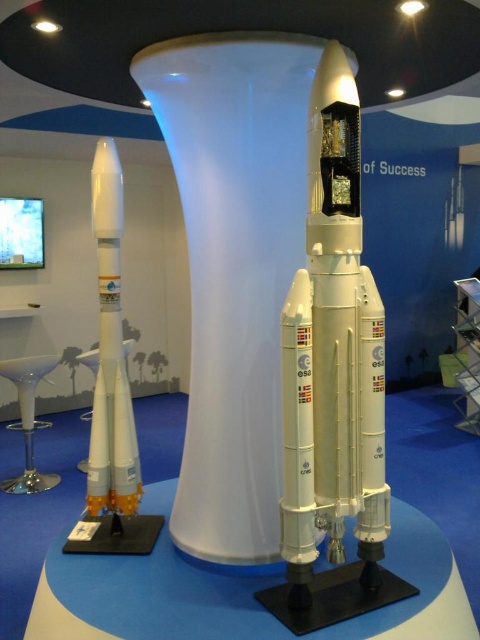
You are standing in front of the rocket display and want to touch the two points marked in the image. Which point, point (286, 618) or point (104, 352), will you reach first if you move straight toward the display?

Point (286, 618) is closer to the viewer than point (104, 352), so you will reach point (286, 618) first.

You are standing in front of the display setup with the white matte rocket at center. If you were to walk directly towards the rocket, which direction should you move relative to your current position?

Since the white matte rocket at center is positioned at point 0.600 on the x and 0.694 on the y coordinate, you should move forward towards the center of the display to reach it.